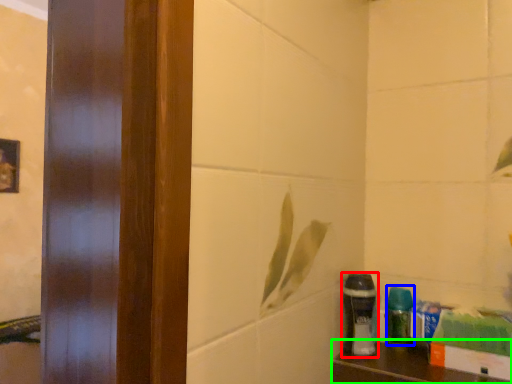
Question: Based on their relative distances, which object is farther from shaving cream (highlighted by a red box)? Choose from cleaning product (highlighted by a blue box) and furniture (highlighted by a green box).

Choices:
 (A) cleaning product
 (B) furniture

Answer: (B)